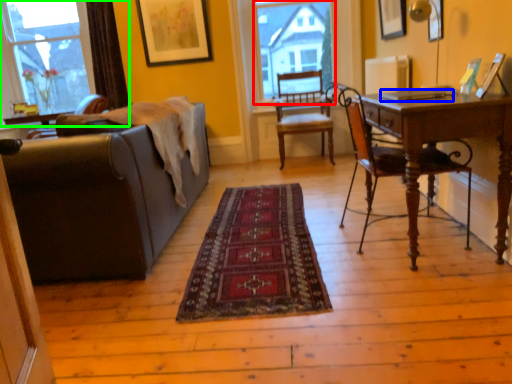
Question: Based on their relative distances, which object is nearer to bay window (highlighted by a red box)? Choose from laptop (highlighted by a blue box) and window (highlighted by a green box).

Choices:
 (A) laptop
 (B) window

Answer: (B)